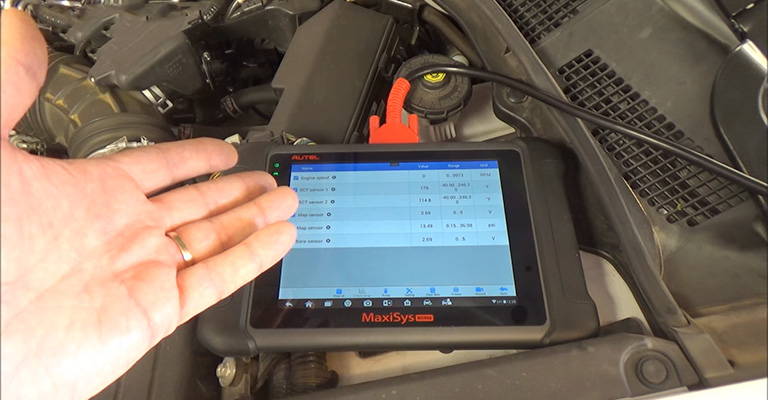
Where is `plug`? plug is located at coordinates (399, 128).